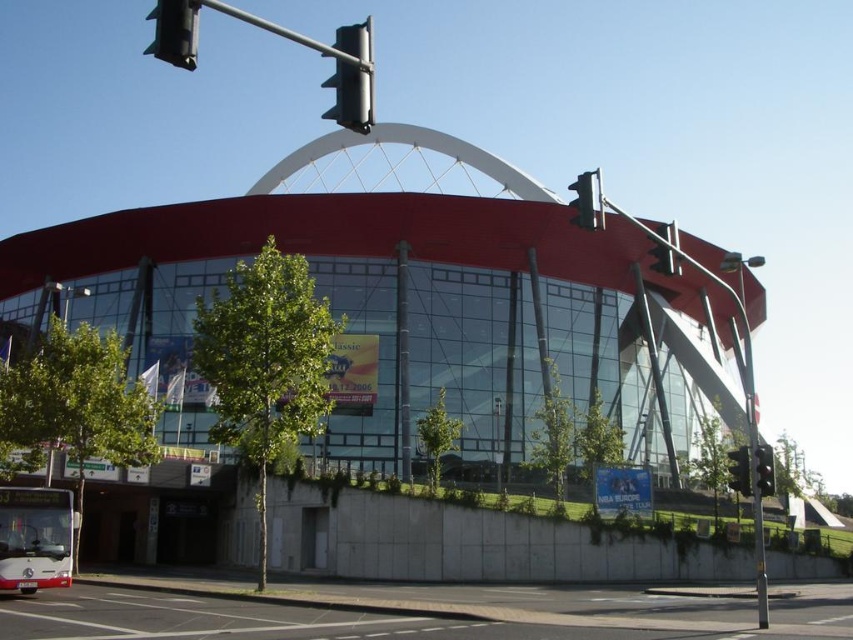
Which is in front, point (358, 68) or point (757, 483)?

Point (358, 68) is more forward.

Does metallic gray traffic light at upper center have a larger size compared to green glass traffic light at right?

Yes.

Who is more forward, (351, 90) or (767, 467)?

Point (351, 90) is more forward.

Image resolution: width=853 pixels, height=640 pixels. I want to click on metallic gray traffic light at upper center, so click(352, 77).

Is metallic gray traffic light at upper center to the left of metallic at upper right from the viewer's perspective?

Correct, you'll find metallic gray traffic light at upper center to the left of metallic at upper right.

Looking at this image, does metallic gray traffic light at upper center have a greater width compared to metallic at upper right?

Indeed, metallic gray traffic light at upper center has a greater width compared to metallic at upper right.

Find the location of `metallic gray traffic light at upper center`. metallic gray traffic light at upper center is located at coordinates (352, 77).

Find the location of `metallic gray traffic light at upper center`. metallic gray traffic light at upper center is located at coordinates (352, 77).

Does metallic at upper right appear on the right side of metallic traffic light at center?

No, metallic at upper right is not to the right of metallic traffic light at center.

Which is in front, point (656, 227) or point (743, 464)?

Positioned in front is point (743, 464).

Who is more distant from viewer, [664,269] or [740,474]?

The point [664,269] is more distant.

Identify the location of metallic at upper right. (664, 250).